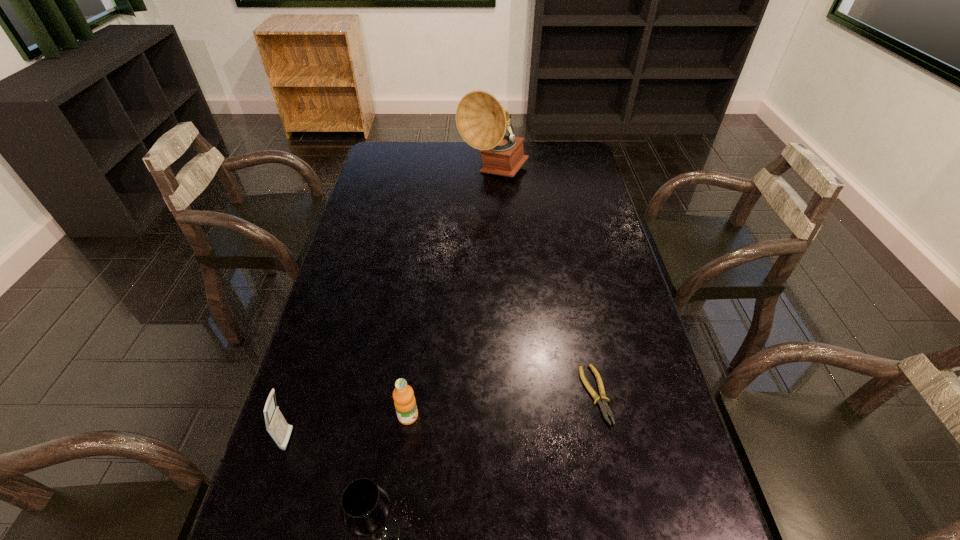
In the image, there is a desktop. Find the location of `free region at the far edge`. free region at the far edge is located at coordinates (471, 159).

Locate an element on the screen. Image resolution: width=960 pixels, height=540 pixels. vacant space at the left edge is located at coordinates (366, 362).

Where is `vacant space at the right edge`? The width and height of the screenshot is (960, 540). vacant space at the right edge is located at coordinates (650, 352).

The image size is (960, 540). In the image, there is a desktop. What are the coordinates of `free space at the far left corner` in the screenshot? It's located at (387, 146).

This screenshot has width=960, height=540. In the image, there is a desktop. Identify the location of vacant space at the far right corner. (583, 147).

Image resolution: width=960 pixels, height=540 pixels. I want to click on unoccupied area between the leftmost object and the pliers, so click(x=443, y=417).

You are a GUI agent. You are given a task and a screenshot of the screen. Output one action in this format:
    pyautogui.click(x=<x>, y=<y>)
    Task: Click on the unoccupied area between the fourth tallest object and the farthest object
    This screenshot has width=960, height=540.
    Given the screenshot: What is the action you would take?
    pyautogui.click(x=451, y=294)

In order to click on free space between the orange juice and the fourth farthest object in this screenshot , I will do `click(348, 428)`.

Identify the location of free area in between the second shortest object and the farthest object. (451, 294).

Locate an element on the screen. free point between the rightmost object and the fourth object from left to right is located at coordinates (544, 284).